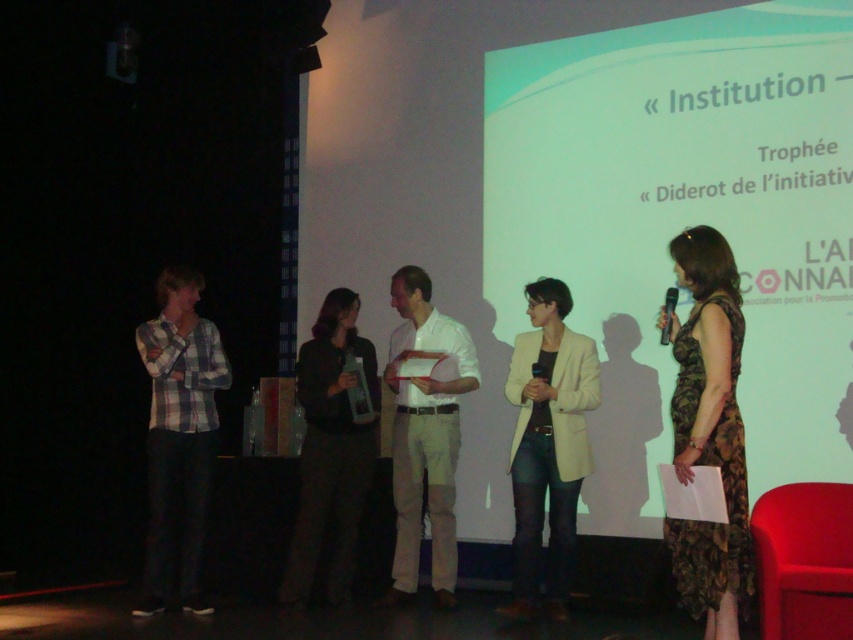
Which is more to the right, plaid cotton shirt at left or dark brown fabric jacket at center?

From the viewer's perspective, dark brown fabric jacket at center appears more on the right side.

Does plaid cotton shirt at left have a greater width compared to dark brown fabric jacket at center?

Incorrect, plaid cotton shirt at left's width does not surpass dark brown fabric jacket at center's.

Where is `plaid cotton shirt at left`? This screenshot has height=640, width=853. plaid cotton shirt at left is located at coordinates (178, 433).

Between point (544, 173) and point (566, 573), which one is positioned in front?

Point (566, 573) is more forward.

Does white glossy projection screen at upper center have a lesser height compared to matte beige blazer at center?

Incorrect, white glossy projection screen at upper center's height does not fall short of matte beige blazer at center's.

Does point (514, 298) lie in front of point (511, 483)?

No, it is not.

Find the location of a particular element. The height and width of the screenshot is (640, 853). white glossy projection screen at upper center is located at coordinates (683, 224).

Is white glossy projection screen at upper center positioned behind dark brown fabric jacket at center?

No.

Is white glossy projection screen at upper center smaller than dark brown fabric jacket at center?

Incorrect, white glossy projection screen at upper center is not smaller in size than dark brown fabric jacket at center.

Between point (753, 332) and point (318, 385), which one is positioned behind?

The point (318, 385) is more distant.

This screenshot has width=853, height=640. Identify the location of white glossy projection screen at upper center. (683, 224).